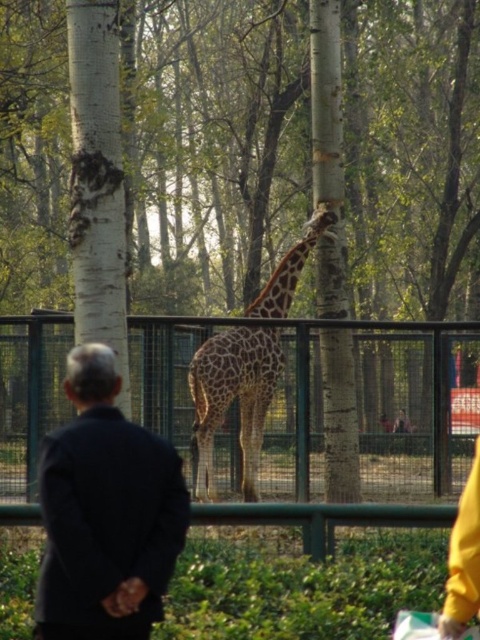
Does green metal fence at center have a lesser width compared to dark blue suit at center?

Incorrect, green metal fence at center's width is not less than dark blue suit at center's.

Does green metal fence at center appear over dark blue suit at center?

Correct, green metal fence at center is located above dark blue suit at center.

Which is in front, point (360, 324) or point (175, 522)?

Positioned in front is point (175, 522).

You are a GUI agent. You are given a task and a screenshot of the screen. Output one action in this format:
    pyautogui.click(x=<x>, y=<y>)
    Task: Click on the green metal fence at center
    
    Given the screenshot: What is the action you would take?
    pyautogui.click(x=375, y=406)

Is green metal fence at center shorter than spotted fur giraffe at center?

No.

In order to click on green metal fence at center in this screenshot , I will do `click(375, 406)`.

The width and height of the screenshot is (480, 640). What are the coordinates of `green metal fence at center` in the screenshot? It's located at (375, 406).

Can you confirm if dark blue suit at center is positioned above spotted fur giraffe at center?

Yes, dark blue suit at center is above spotted fur giraffe at center.

The width and height of the screenshot is (480, 640). What are the coordinates of `dark blue suit at center` in the screenshot? It's located at (106, 513).